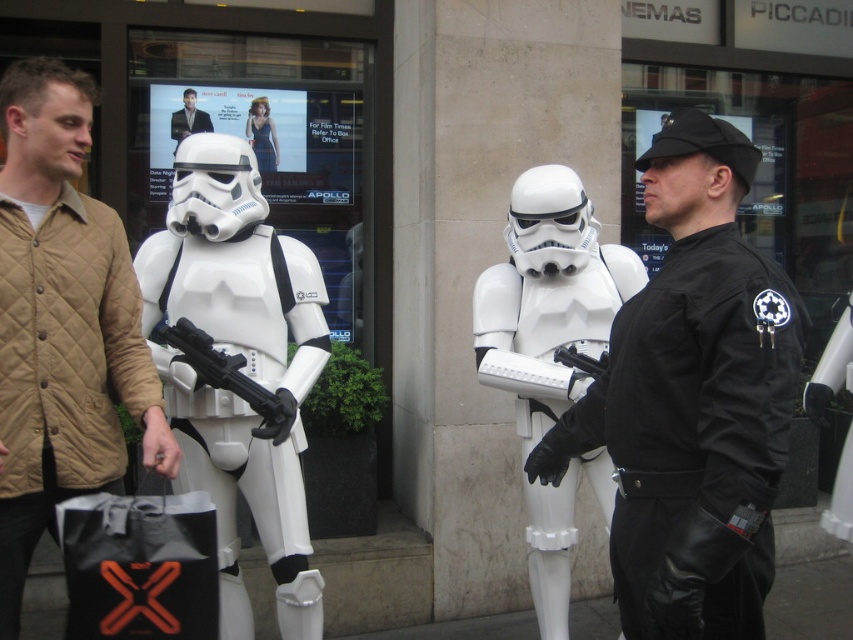
Question: Which of these objects is positioned farthest from the quilted beige jacket at left?

Choices:
 (A) black leather glove at center
 (B) smooth skin man at upper left

Answer: (B)

Question: Does quilted beige jacket at left come behind white matte stormtrooper at left?

Choices:
 (A) no
 (B) yes

Answer: (A)

Question: Which of the following is the closest to the observer?

Choices:
 (A) (218, 492)
 (B) (97, 243)
 (C) (718, 522)
 (D) (175, 125)

Answer: (C)

Question: Is black leather jacket at center above black matte shopping bag at lower left?

Choices:
 (A) yes
 (B) no

Answer: (A)

Question: Which point appears farthest from the camera in this image?

Choices:
 (A) (267, 166)
 (B) (120, 540)

Answer: (A)

Question: Is white matte stormtrooper at left wider than black matte shopping bag at lower left?

Choices:
 (A) no
 (B) yes

Answer: (B)